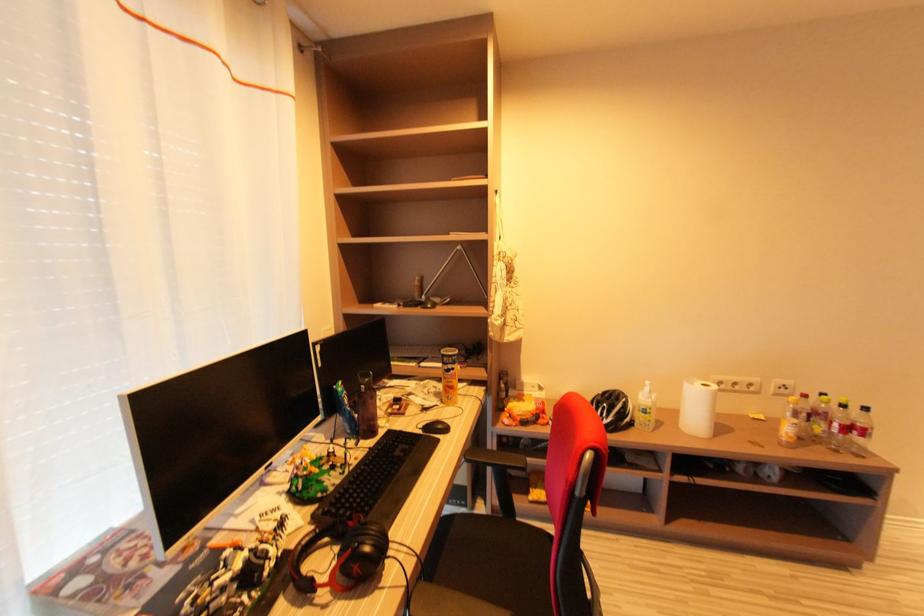
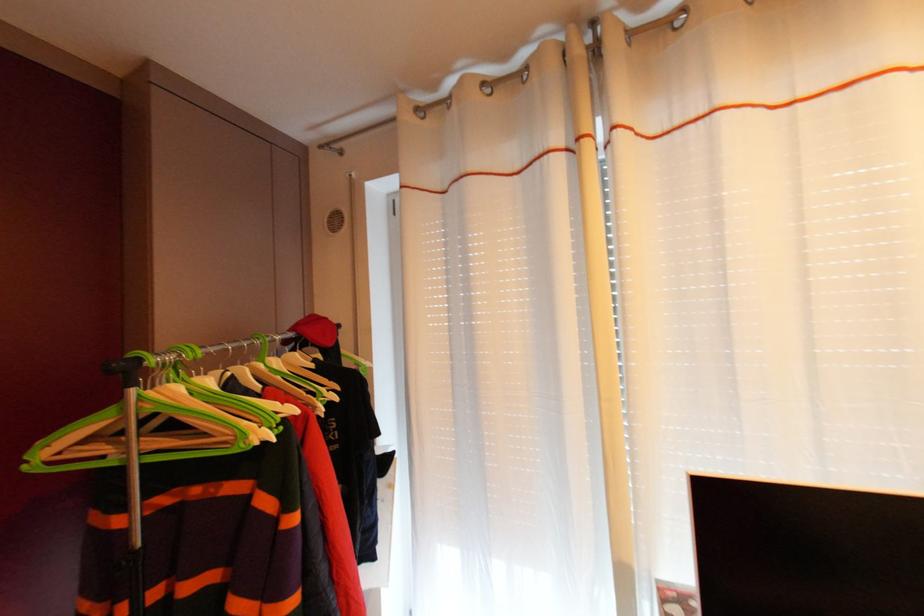
Question: The images are taken continuously from a first-person perspective. In which direction is your viewpoint rotating?

Choices:
 (A) Left
 (B) Right
 (C) Up
 (D) Down

Answer: (A)